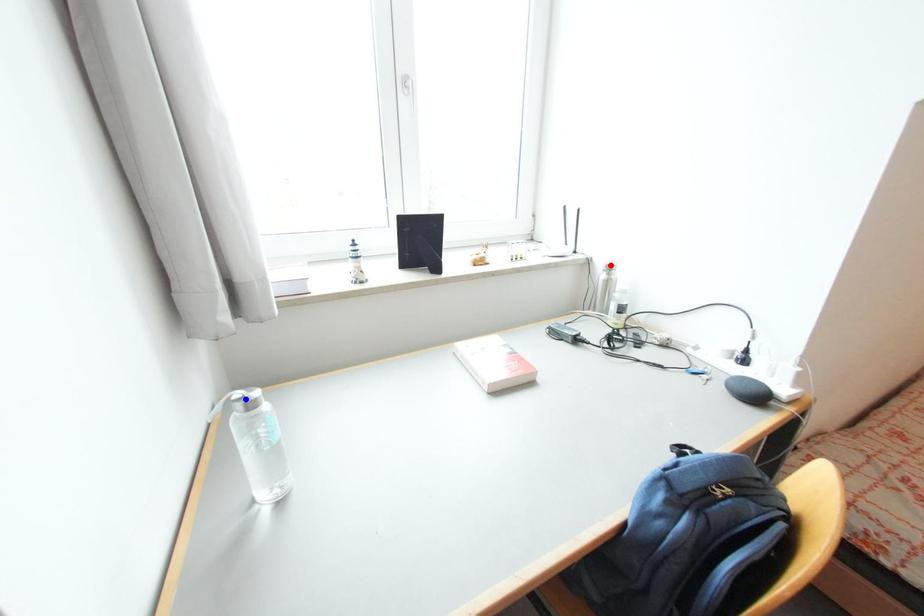
Question: Which of the two points in the image is closer to the camera?

Choices:
 (A) Blue point is closer.
 (B) Red point is closer.

Answer: (A)